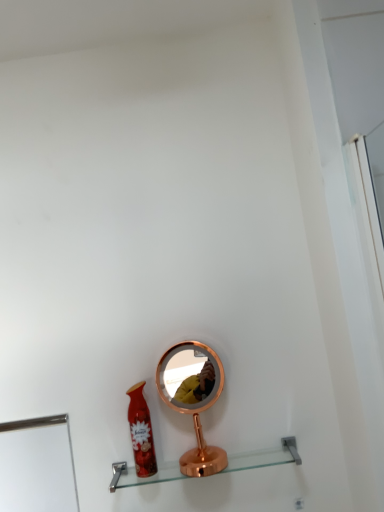
Question: Is matte red spray can at lower center not close to copper metallic mirror at center?

Choices:
 (A) no
 (B) yes

Answer: (A)

Question: Is matte red spray can at lower center at the right side of copper metallic mirror at center?

Choices:
 (A) no
 (B) yes

Answer: (A)

Question: Is matte red spray can at lower center directly adjacent to copper metallic mirror at center?

Choices:
 (A) no
 (B) yes

Answer: (A)

Question: From the image's perspective, is matte red spray can at lower center under copper metallic mirror at center?

Choices:
 (A) yes
 (B) no

Answer: (A)

Question: From the image's perspective, is matte red spray can at lower center above copper metallic mirror at center?

Choices:
 (A) no
 (B) yes

Answer: (A)

Question: Is copper metallic mirror at center bigger or smaller than matte red spray can at lower center?

Choices:
 (A) small
 (B) big

Answer: (B)

Question: Considering their positions, is copper metallic mirror at center located in front of or behind matte red spray can at lower center?

Choices:
 (A) behind
 (B) front

Answer: (A)

Question: Considering the positions of copper metallic mirror at center and matte red spray can at lower center in the image, is copper metallic mirror at center taller or shorter than matte red spray can at lower center?

Choices:
 (A) tall
 (B) short

Answer: (A)

Question: From a real-world perspective, is copper metallic mirror at center above or below matte red spray can at lower center?

Choices:
 (A) below
 (B) above

Answer: (B)

Question: Looking at their shapes, would you say clear glass shelf at center is wider or thinner than copper metallic mirror at center?

Choices:
 (A) wide
 (B) thin

Answer: (B)

Question: Considering the positions of clear glass shelf at center and copper metallic mirror at center in the image, is clear glass shelf at center bigger or smaller than copper metallic mirror at center?

Choices:
 (A) big
 (B) small

Answer: (B)

Question: From a real-world perspective, relative to copper metallic mirror at center, is clear glass shelf at center vertically above or below?

Choices:
 (A) below
 (B) above

Answer: (A)

Question: From the image's perspective, relative to copper metallic mirror at center, is clear glass shelf at center above or below?

Choices:
 (A) below
 (B) above

Answer: (A)

Question: From a real-world perspective, is clear glass shelf at center positioned above or below matte red spray can at lower center?

Choices:
 (A) above
 (B) below

Answer: (B)

Question: Looking at the image, does clear glass shelf at center seem bigger or smaller compared to matte red spray can at lower center?

Choices:
 (A) small
 (B) big

Answer: (B)